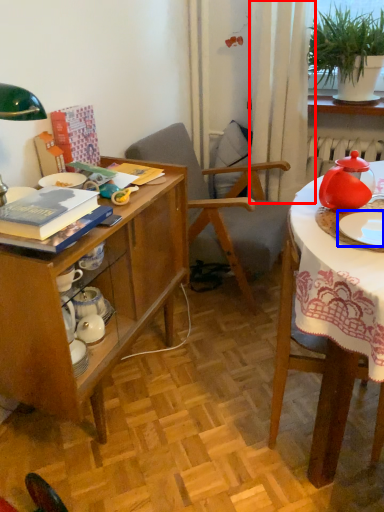
Question: Among these objects, which one is farthest to the camera, curtain (highlighted by a red box) or tableware (highlighted by a blue box)?

Choices:
 (A) curtain
 (B) tableware

Answer: (A)